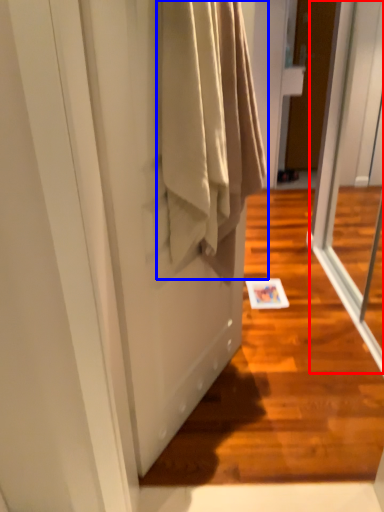
Question: Which point is further to the camera, screen door (highlighted by a red box) or clothing (highlighted by a blue box)?

Choices:
 (A) screen door
 (B) clothing

Answer: (A)